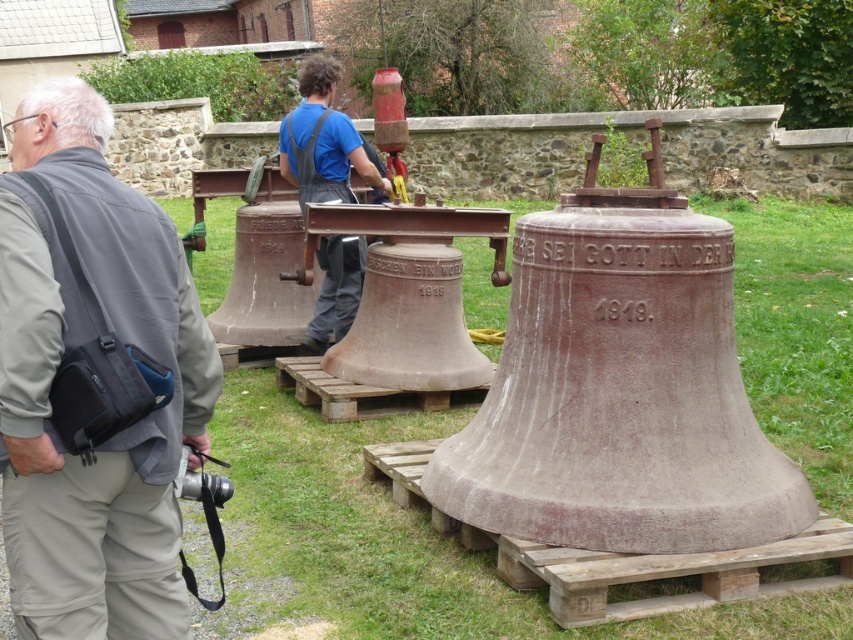
Question: Which point appears closest to the camera in this image?

Choices:
 (A) (39, 595)
 (B) (329, 122)

Answer: (A)

Question: In this image, where is gray fabric bag at lower left located relative to blue denim overalls at center?

Choices:
 (A) right
 (B) left

Answer: (B)

Question: Does gray fabric bag at lower left appear under blue denim overalls at center?

Choices:
 (A) yes
 (B) no

Answer: (A)

Question: Which point is farther to the camera?

Choices:
 (A) (318, 116)
 (B) (61, 337)

Answer: (A)

Question: Can you confirm if gray fabric bag at lower left is positioned below blue denim overalls at center?

Choices:
 (A) yes
 (B) no

Answer: (A)